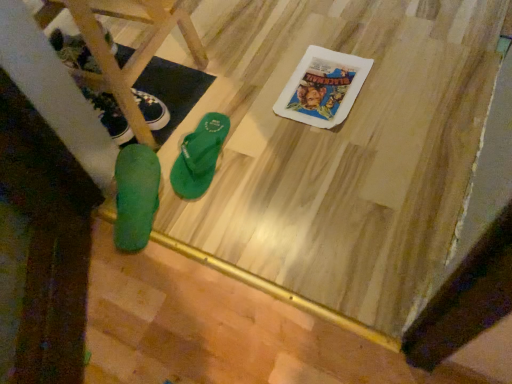
Locate an element on the screen. The height and width of the screenshot is (384, 512). free space in front of green rubber flip-flop at center, the third footwear positioned from the left is located at coordinates (221, 209).